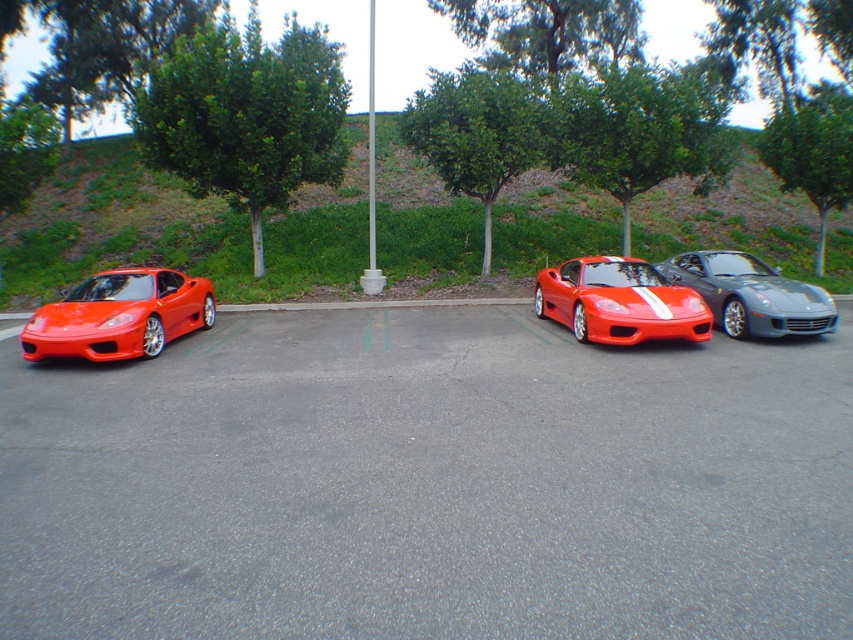
You are standing at the center of the parking lot and want to find the green grass at upper center. According to the coordinates provided, in which direction should you look to find it?

The green grass at upper center is located at point coordinates, so you should look upwards from the center of the parking lot to find it.

You are standing in a parking lot looking at the scene. There is green grass at upper center and a shiny red sports car at center. Which object is positioned to the left of the other?

The green grass at upper center is positioned to the left of the shiny red sports car at center.

You are a photographer trying to capture the shiny red sports car at center. However, there is green grass at upper center blocking your view. Can you tell me which one is larger so I can adjust my camera angle accordingly?

The green grass at upper center is bigger than the shiny red sports car at center, so you need to adjust your camera angle to account for its larger size to ensure the shiny red sports car at center is fully visible.